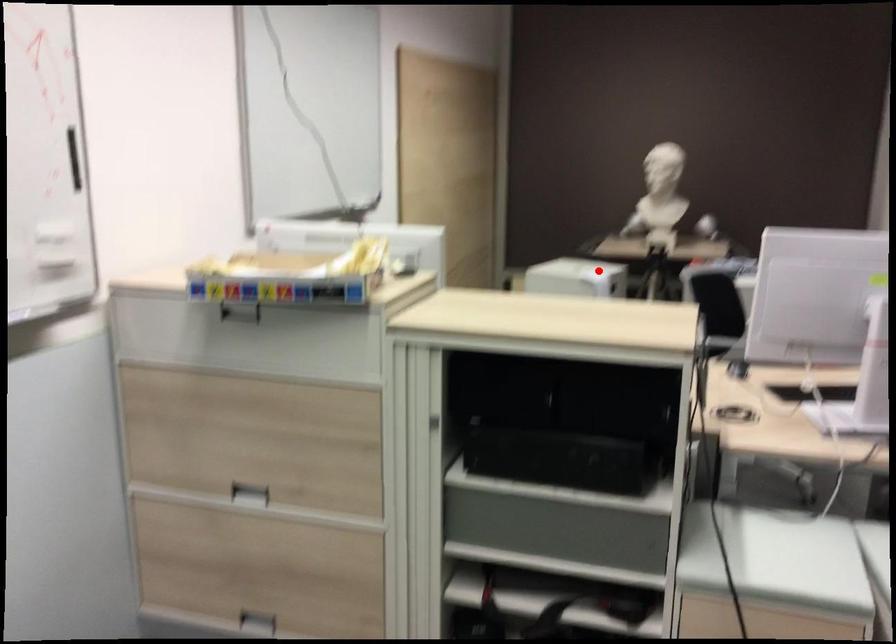
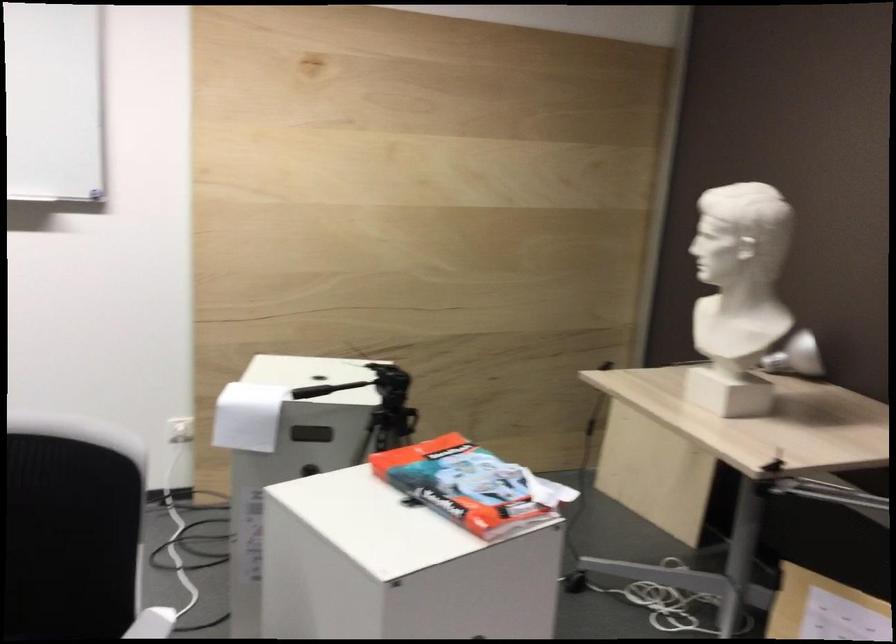
Where in the second image is the point corresponding to the highlighted location from the first image?

(247, 415)